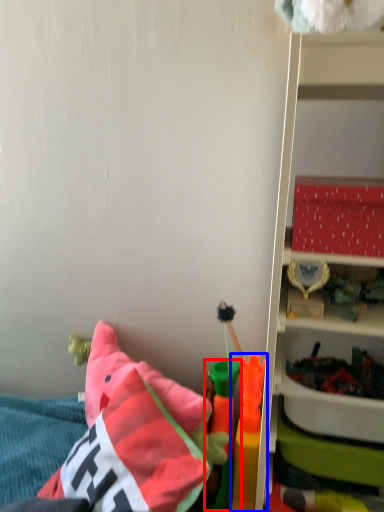
Question: Which point is further to the camera, toy (highlighted by a red box) or toy (highlighted by a blue box)?

Choices:
 (A) toy
 (B) toy

Answer: (A)